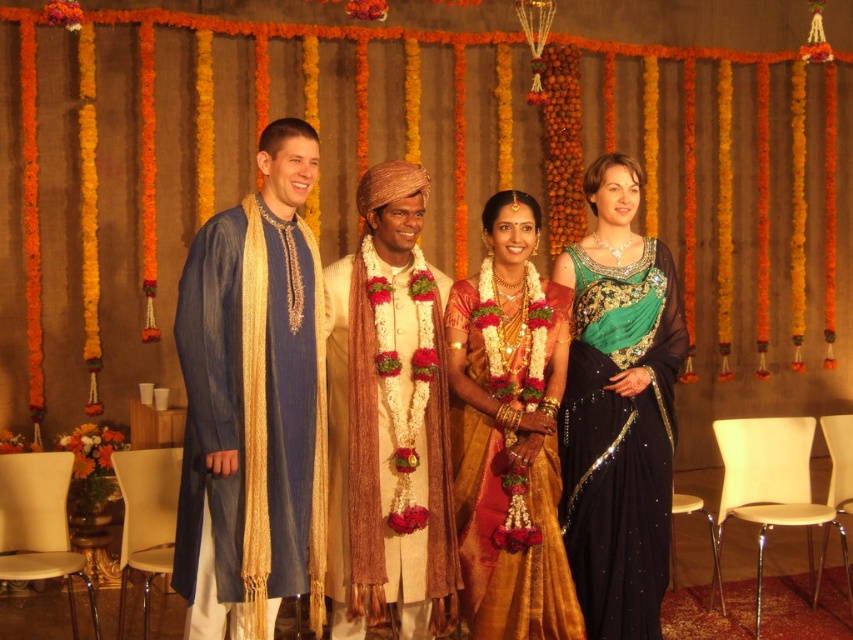
Question: Which object appears farthest from the camera in this image?

Choices:
 (A) gold silk saree at center
 (B) blue silk kurta at left
 (C) beige silk kurta with floral garland at center
 (D) green sequined saree at right

Answer: (D)

Question: Can you confirm if blue silk kurta at left is positioned above gold silk saree at center?

Choices:
 (A) yes
 (B) no

Answer: (A)

Question: Which point appears farthest from the camera in this image?

Choices:
 (A) (640, 584)
 (B) (509, 236)

Answer: (A)

Question: From the image, what is the correct spatial relationship of blue silk kurta at left in relation to gold silk saree at center?

Choices:
 (A) left
 (B) right

Answer: (A)

Question: Considering the relative positions of beige silk kurta with floral garland at center and gold silk saree at center in the image provided, where is beige silk kurta with floral garland at center located with respect to gold silk saree at center?

Choices:
 (A) below
 (B) above

Answer: (B)

Question: Which point is closer to the camera taking this photo?

Choices:
 (A) (370, 477)
 (B) (547, 440)
 (C) (607, 422)
 (D) (300, 436)

Answer: (D)